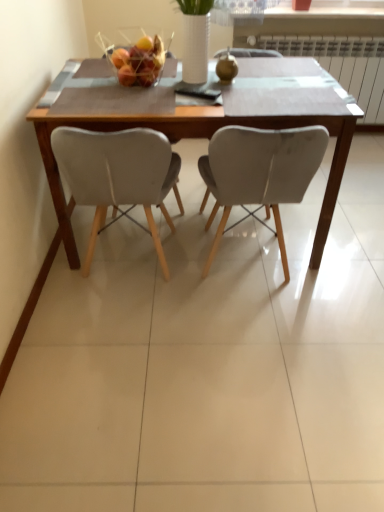
The width and height of the screenshot is (384, 512). What are the coordinates of `free space on the front side of metallic wire basket at center` in the screenshot? It's located at (139, 100).